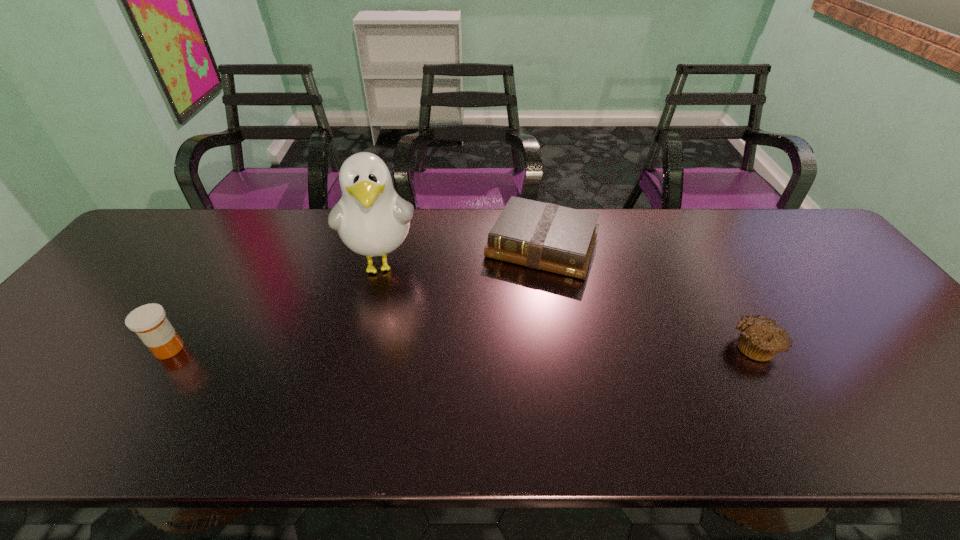
The height and width of the screenshot is (540, 960). In the image, there is a desktop. Find the location of `vacant space at the far left corner`. vacant space at the far left corner is located at coordinates (168, 214).

Identify the location of free space between the rightmost object and the gull. (568, 304).

Where is `free area in between the rightmost object and the second object from right to left`? The image size is (960, 540). free area in between the rightmost object and the second object from right to left is located at coordinates (648, 295).

Where is `blank region between the rightmost object and the second object from left to right`? This screenshot has width=960, height=540. blank region between the rightmost object and the second object from left to right is located at coordinates (568, 304).

I want to click on free point between the second object from right to left and the tallest object, so click(462, 254).

I want to click on free area in between the muffin and the medicine, so click(462, 347).

You are a GUI agent. You are given a task and a screenshot of the screen. Output one action in this format:
    pyautogui.click(x=<x>, y=<y>)
    Task: Click on the free space between the rightmost object and the second object from right to left
    This screenshot has height=540, width=960.
    Given the screenshot: What is the action you would take?
    pyautogui.click(x=648, y=295)

Find the location of a particular element. This screenshot has width=960, height=540. free spot between the Bible and the tallest object is located at coordinates (462, 254).

Find the location of `free space between the Bible and the rightmost object`. free space between the Bible and the rightmost object is located at coordinates (648, 295).

The height and width of the screenshot is (540, 960). Identify the location of empty location between the third object from left to right and the gull. (462, 254).